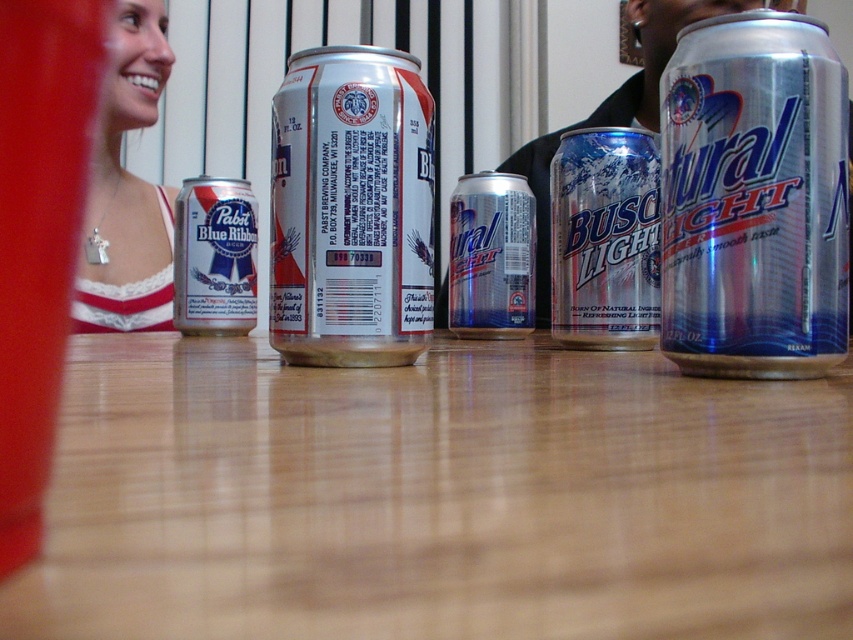
You are a bartender preparing a drink order and see the white lace top at upper left and the matte silver can at left on the table. Which object takes up more space on the table?

The white lace top at upper left has a larger size compared to the matte silver can at left, so it takes up more space on the table.

You are standing 1 meter away from the wooden table where the beer cans are placed. You want to reach a specific point on the table marked as point (601, 220). Can you comfortably reach that point without moving your position?

The distance of point (601, 220) from viewer is 1.12 meters, so you are 0.12 meters too far to comfortably reach it without moving.

You are looking at a table with several beer cans. There is a point marked at coordinates (605, 240). Which beer can is located at that point?

The point at coordinates (605, 240) indicates the silver metallic Busch Light can at center.